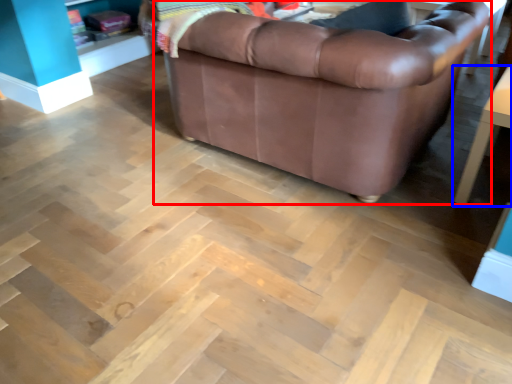
Question: Among these objects, which one is farthest to the camera, studio couch (highlighted by a red box) or table (highlighted by a blue box)?

Choices:
 (A) studio couch
 (B) table

Answer: (B)